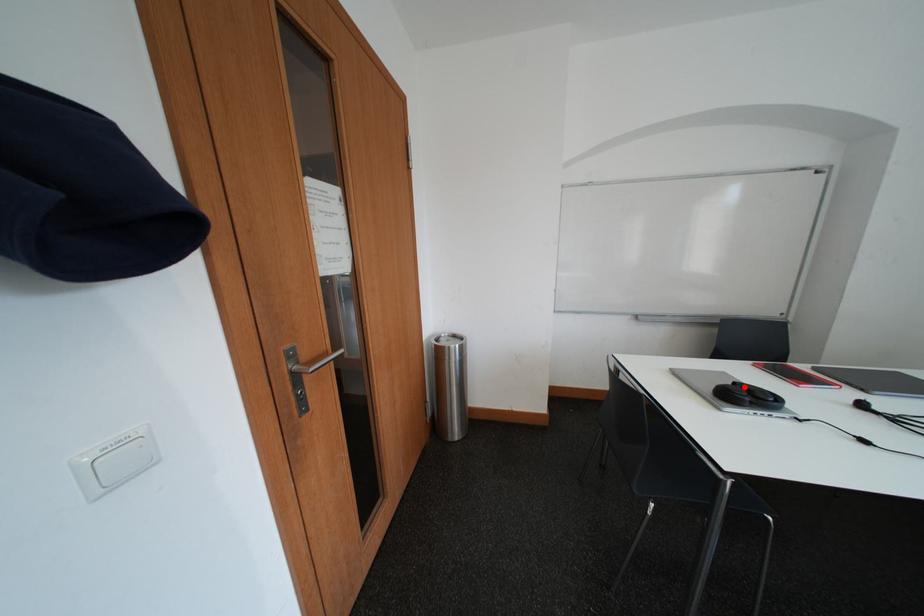
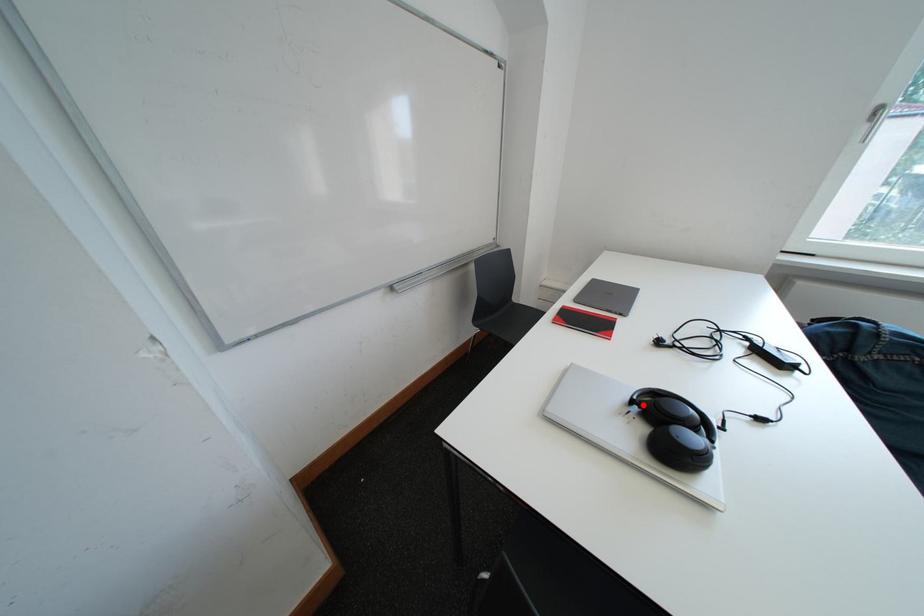
I am providing you with two images of the same scene from different viewpoints. A red point is marked on the first image and another point is marked on the second image. Do the highlighted points in image1 and image2 indicate the same real-world spot?

Yes